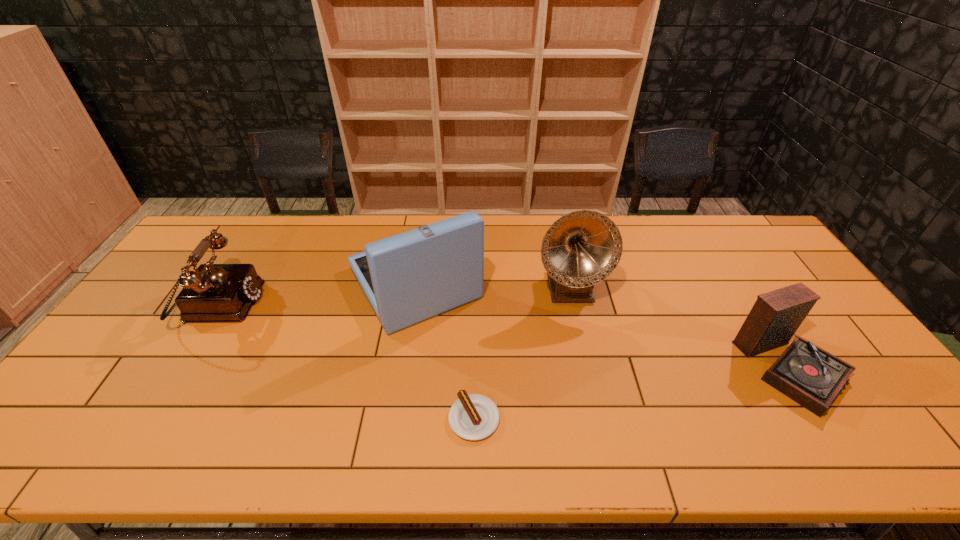
I want to click on the second object from right to left, so click(x=582, y=248).

Find the location of `the leftmost phonograph record`. the leftmost phonograph record is located at coordinates (408, 278).

Image resolution: width=960 pixels, height=540 pixels. Identify the location of telephone. (213, 292).

The width and height of the screenshot is (960, 540). In order to click on the rightmost phonograph record in this screenshot , I will do `click(809, 375)`.

Image resolution: width=960 pixels, height=540 pixels. Find the location of `the rightmost object`. the rightmost object is located at coordinates (809, 375).

At what (x,y) coordinates should I click in order to perform the action: click on the shortest object. Please return your answer as a coordinate pair (x, y). The height and width of the screenshot is (540, 960). Looking at the image, I should click on (473, 417).

Where is `vacant space situated on the horn of the second phonograph record from left to right`? vacant space situated on the horn of the second phonograph record from left to right is located at coordinates (582, 348).

This screenshot has width=960, height=540. Identify the location of vacant region located 0.300m on the front of the leftmost phonograph record. (390, 438).

Find the location of a particular element. vacant space located 0.350m on the dial of the telephone is located at coordinates (376, 305).

Identify the location of free space located on the back of the shortest phonograph record. (725, 261).